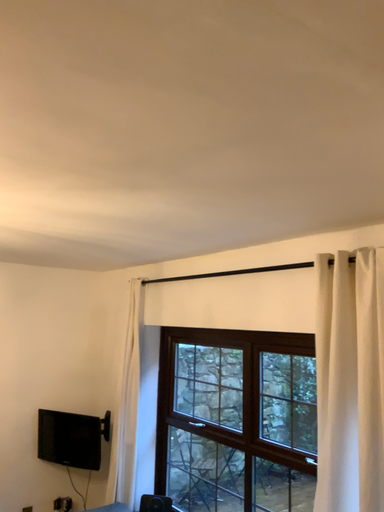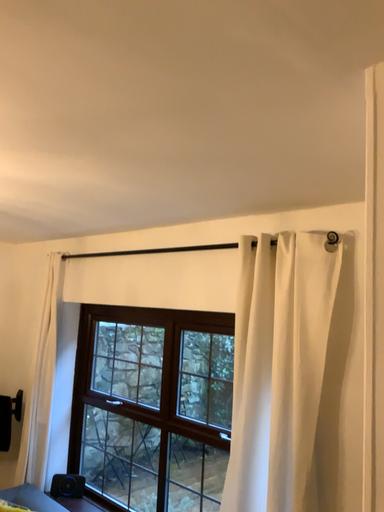
Question: Which way did the camera rotate in the video?

Choices:
 (A) rotated left
 (B) rotated right

Answer: (B)